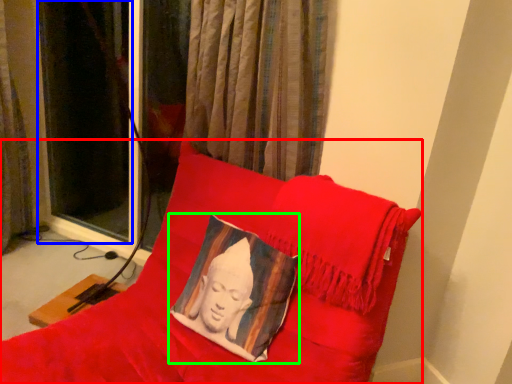
Question: Based on their relative distances, which object is farther from furniture (highlighted by a red box)? Choose from curtain (highlighted by a blue box) and pillow (highlighted by a green box).

Choices:
 (A) curtain
 (B) pillow

Answer: (A)